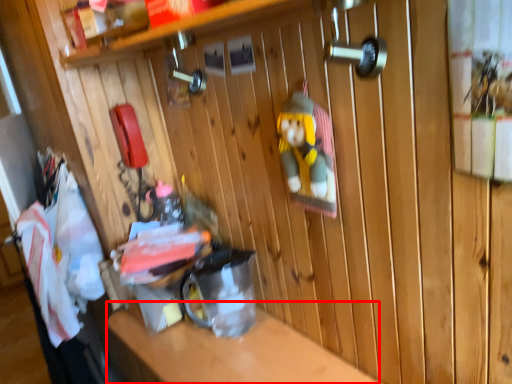
Question: Considering the relative positions of counter top (annotated by the red box) and laundry in the image provided, where is counter top (annotated by the red box) located with respect to the staircase?

Choices:
 (A) right
 (B) left

Answer: (A)